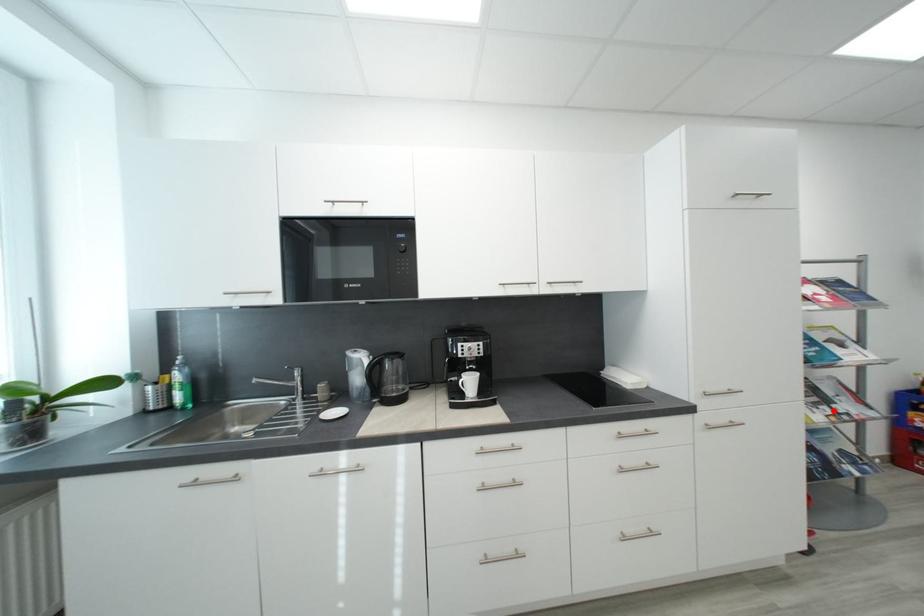
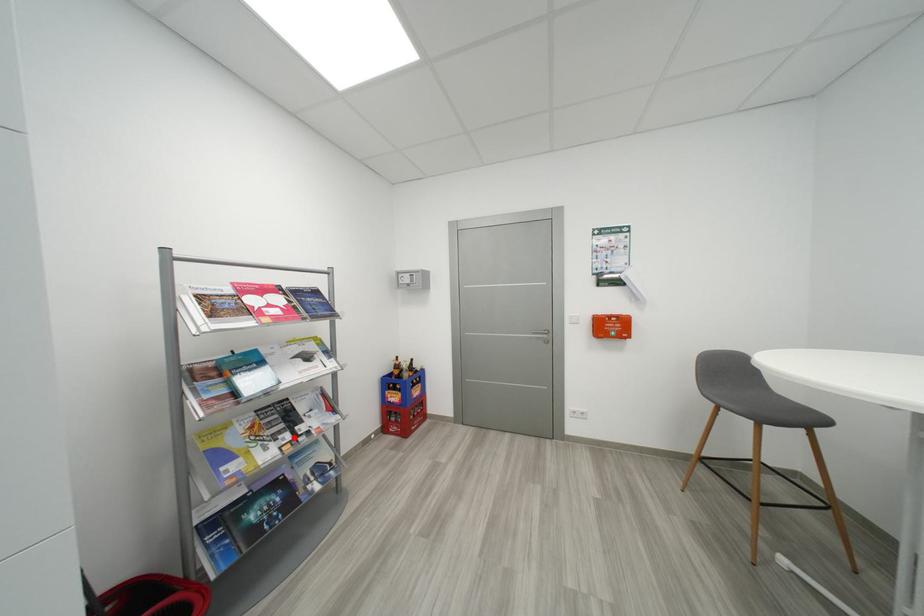
I am providing you with two images of the same scene from different viewpoints. A red point is marked on the first image and another point is marked on the second image. Do the highlighted points in image1 and image2 indicate the same real-world spot?

Yes